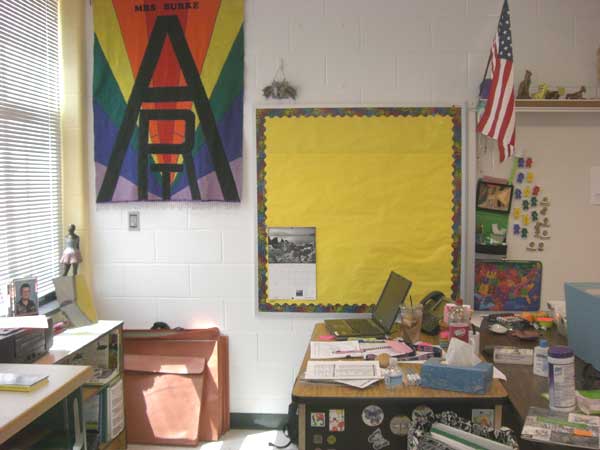
This screenshot has height=450, width=600. Identify the location of white board. (567, 182).